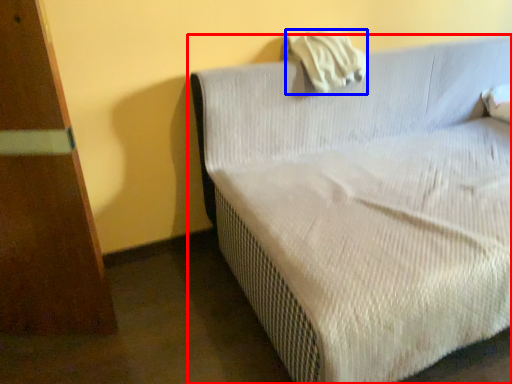
Question: Which of the following is the farthest to the observer, studio couch (highlighted by a red box) or pillow (highlighted by a blue box)?

Choices:
 (A) studio couch
 (B) pillow

Answer: (B)